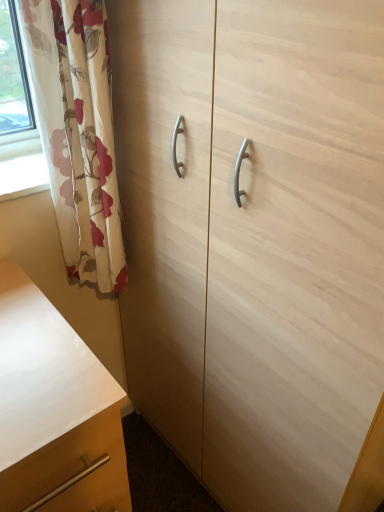
Question: From a real-world perspective, does floral fabric curtain at left sit lower than light wood cabinet at center?

Choices:
 (A) no
 (B) yes

Answer: (A)

Question: Could light wood cabinet at center be considered to be inside floral fabric curtain at left?

Choices:
 (A) no
 (B) yes

Answer: (A)

Question: Considering the relative positions of floral fabric curtain at left and light wood cabinet at center in the image provided, is floral fabric curtain at left to the left of light wood cabinet at center from the viewer's perspective?

Choices:
 (A) yes
 (B) no

Answer: (A)

Question: Considering the relative sizes of floral fabric curtain at left and light wood cabinet at center in the image provided, is floral fabric curtain at left thinner than light wood cabinet at center?

Choices:
 (A) no
 (B) yes

Answer: (B)

Question: Is floral fabric curtain at left in front of light wood cabinet at center?

Choices:
 (A) yes
 (B) no

Answer: (B)

Question: Is matte wood chest of drawers at lower left spatially inside light wood cabinet at center, or outside of it?

Choices:
 (A) outside
 (B) inside

Answer: (A)

Question: Is matte wood chest of drawers at lower left in front of or behind light wood cabinet at center in the image?

Choices:
 (A) front
 (B) behind

Answer: (B)

Question: In terms of height, does matte wood chest of drawers at lower left look taller or shorter compared to light wood cabinet at center?

Choices:
 (A) tall
 (B) short

Answer: (B)

Question: Is matte wood chest of drawers at lower left bigger or smaller than light wood cabinet at center?

Choices:
 (A) big
 (B) small

Answer: (B)

Question: Is light wood cabinet at center wider or thinner than matte wood chest of drawers at lower left?

Choices:
 (A) thin
 (B) wide

Answer: (A)

Question: Does point (352, 74) appear closer or farther from the camera than point (31, 490)?

Choices:
 (A) closer
 (B) farther

Answer: (A)

Question: From their relative heights in the image, would you say light wood cabinet at center is taller or shorter than matte wood chest of drawers at lower left?

Choices:
 (A) tall
 (B) short

Answer: (A)

Question: Is light wood cabinet at center situated inside matte wood chest of drawers at lower left or outside?

Choices:
 (A) inside
 (B) outside

Answer: (B)

Question: From a real-world perspective, is floral fabric curtain at left physically located above or below light wood cabinet at center?

Choices:
 (A) above
 (B) below

Answer: (A)

Question: Relative to light wood cabinet at center, is floral fabric curtain at left in front or behind?

Choices:
 (A) behind
 (B) front

Answer: (A)